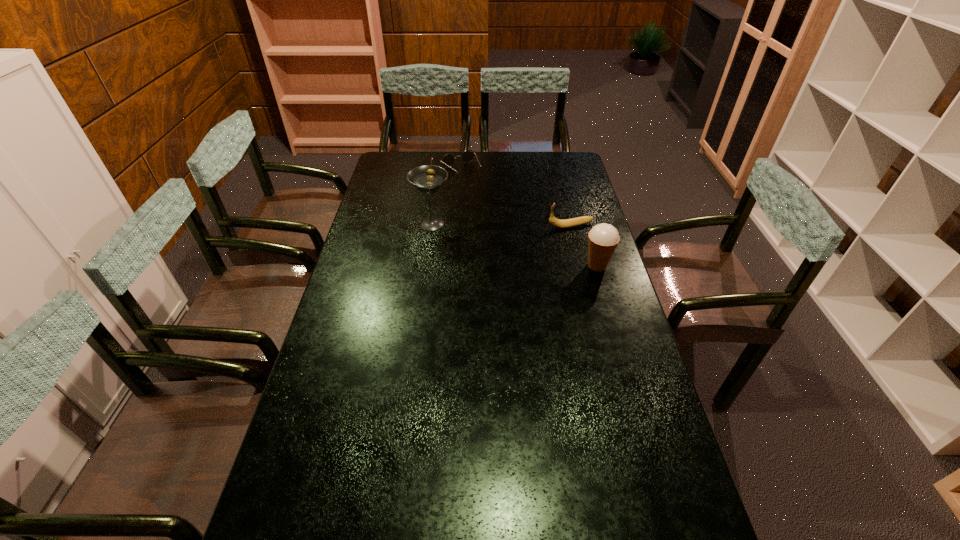
Locate an element on the screen. This screenshot has height=540, width=960. vacant position located 0.390m at the stem of the banana is located at coordinates (449, 241).

The height and width of the screenshot is (540, 960). In order to click on free space located on the front-facing side of the farthest object in this screenshot , I will do `click(486, 198)`.

The width and height of the screenshot is (960, 540). Identify the location of free spot located 0.080m on the front-facing side of the farthest object. (477, 187).

Identify the location of vacant space located 0.360m on the front-facing side of the farthest object. The image size is (960, 540). pos(508,222).

The width and height of the screenshot is (960, 540). What are the coordinates of `object present at the far edge` in the screenshot? It's located at (448, 160).

You are a GUI agent. You are given a task and a screenshot of the screen. Output one action in this format:
    pyautogui.click(x=<x>, y=<y>)
    Task: Click on the icecream positioned at the right edge
    
    Given the screenshot: What is the action you would take?
    pyautogui.click(x=603, y=238)

Locate an element on the screen. banana at the right edge is located at coordinates (567, 223).

The image size is (960, 540). I want to click on blank space at the far edge of the desktop, so click(x=451, y=152).

The width and height of the screenshot is (960, 540). What are the coordinates of `free spot at the near edge of the desktop` in the screenshot? It's located at (613, 528).

Where is `vacant area at the left edge`? The height and width of the screenshot is (540, 960). vacant area at the left edge is located at coordinates (361, 356).